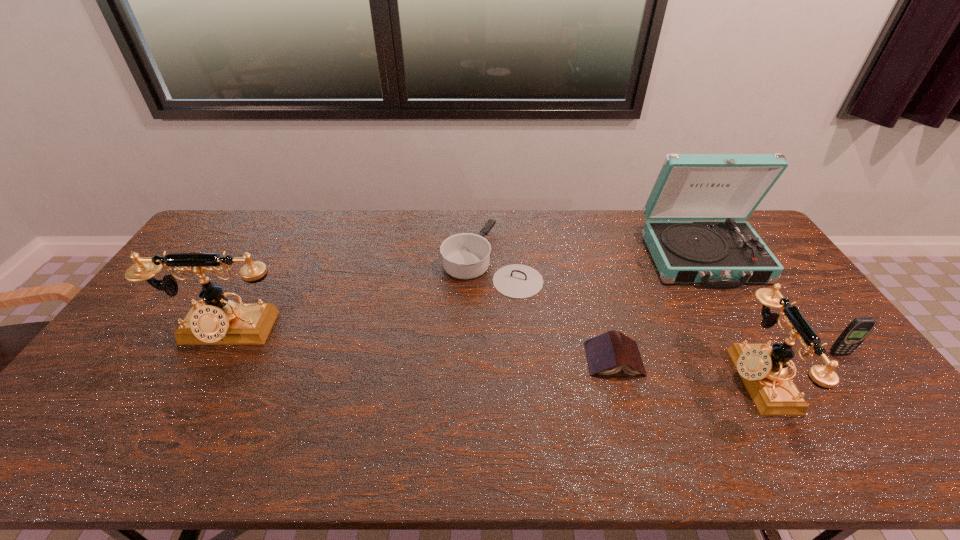
The image size is (960, 540). Find the location of `record player located at the far edge`. record player located at the far edge is located at coordinates (718, 254).

Where is `object that is at the near edge`? object that is at the near edge is located at coordinates (763, 369).

In order to click on object that is positioned at the left edge in this screenshot , I will do `click(216, 321)`.

This screenshot has width=960, height=540. What are the coordinates of `record player positioned at the right edge` in the screenshot? It's located at (718, 254).

Find the location of a particular element. cellular telephone located in the right edge section of the desktop is located at coordinates (855, 333).

The image size is (960, 540). I want to click on object positioned at the far right corner, so click(718, 254).

In the image, there is a desktop. Where is `free space at the far edge`? This screenshot has height=540, width=960. free space at the far edge is located at coordinates (312, 235).

Where is `free space at the near edge of the desktop`? Image resolution: width=960 pixels, height=540 pixels. free space at the near edge of the desktop is located at coordinates (712, 401).

The image size is (960, 540). Find the location of `blank space at the left edge of the desktop`. blank space at the left edge of the desktop is located at coordinates point(145,339).

Image resolution: width=960 pixels, height=540 pixels. I want to click on vacant area at the far left corner, so click(x=207, y=241).